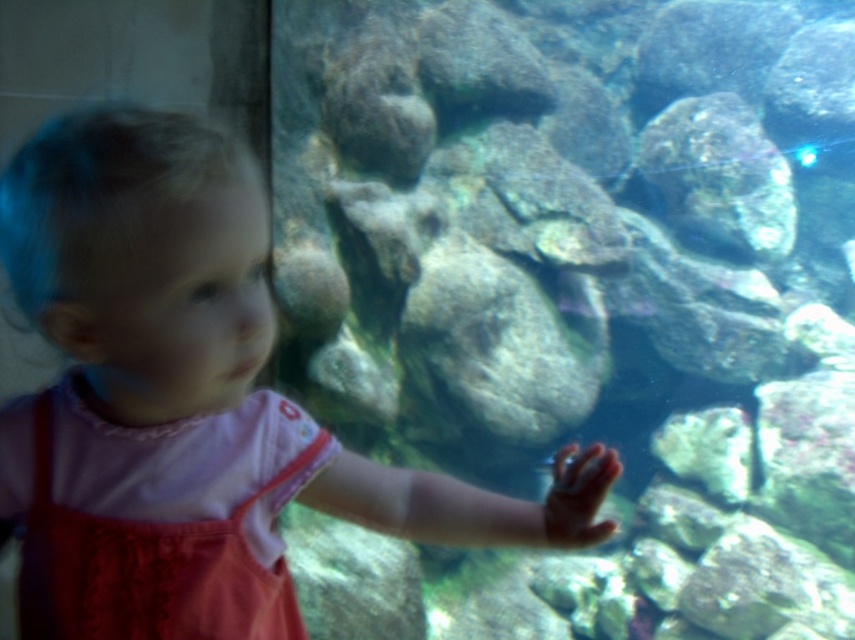
Which is below, pink fabric at center or pink cotton dress at center?

pink cotton dress at center is below.

Is point (222, 620) positioned after point (21, 412)?

No.

Identify the location of pink fabric at center. (189, 401).